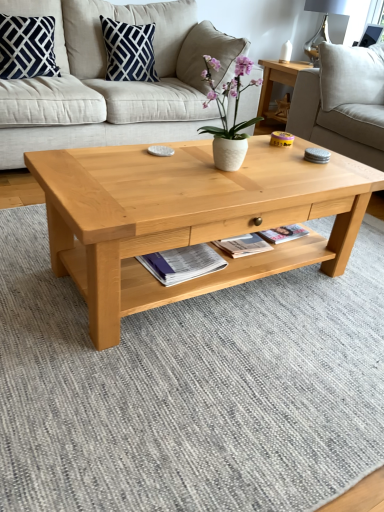
Question: Is navy blue cotton pillow at upper left, which is the 1th pillow in left-to-right order, bigger than white ceramic vase at center?

Choices:
 (A) no
 (B) yes

Answer: (B)

Question: Is navy blue cotton pillow at upper left, which is the 1th pillow in left-to-right order, next to white ceramic vase at center and touching it?

Choices:
 (A) yes
 (B) no

Answer: (B)

Question: From a real-world perspective, is navy blue cotton pillow at upper left, which is the 1th pillow in left-to-right order, physically below white ceramic vase at center?

Choices:
 (A) no
 (B) yes

Answer: (A)

Question: Does navy blue cotton pillow at upper left, which is the 1th pillow in left-to-right order, have a greater height compared to white ceramic vase at center?

Choices:
 (A) yes
 (B) no

Answer: (A)

Question: Is navy blue cotton pillow at upper left, the second pillow when ordered from right to left, wider than white ceramic vase at center?

Choices:
 (A) no
 (B) yes

Answer: (B)

Question: Does navy blue cotton pillow at upper left, which is the 1th pillow in left-to-right order, have a smaller size compared to white ceramic vase at center?

Choices:
 (A) no
 (B) yes

Answer: (A)

Question: Is light beige fabric studio couch at upper right, positioned as the 2th studio couch in left-to-right order, shorter than navy blue cotton pillow at upper left, the second pillow when ordered from right to left?

Choices:
 (A) yes
 (B) no

Answer: (B)

Question: Is light beige fabric studio couch at upper right, the first studio couch when ordered from right to left, at the right side of navy blue cotton pillow at upper left, the second pillow when ordered from right to left?

Choices:
 (A) no
 (B) yes

Answer: (B)

Question: Considering the relative positions of light beige fabric studio couch at upper right, positioned as the 2th studio couch in left-to-right order, and navy blue cotton pillow at upper left, the second pillow when ordered from right to left, in the image provided, is light beige fabric studio couch at upper right, positioned as the 2th studio couch in left-to-right order, to the left of navy blue cotton pillow at upper left, the second pillow when ordered from right to left, from the viewer's perspective?

Choices:
 (A) no
 (B) yes

Answer: (A)

Question: Does light beige fabric studio couch at upper right, the first studio couch when ordered from right to left, have a greater width compared to navy blue cotton pillow at upper left, which is the 1th pillow in left-to-right order?

Choices:
 (A) yes
 (B) no

Answer: (A)

Question: From a real-world perspective, is light beige fabric studio couch at upper right, positioned as the 2th studio couch in left-to-right order, over navy blue cotton pillow at upper left, which is the 1th pillow in left-to-right order?

Choices:
 (A) no
 (B) yes

Answer: (A)

Question: From the image's perspective, does light beige fabric studio couch at upper right, the first studio couch when ordered from right to left, appear lower than navy blue cotton pillow at upper left, which is the 1th pillow in left-to-right order?

Choices:
 (A) yes
 (B) no

Answer: (A)

Question: Is the position of navy blue cotton pillow at upper center, which is the second pillow in left-to-right order, more distant than that of navy blue cotton pillow at upper left, which is the 1th pillow in left-to-right order?

Choices:
 (A) no
 (B) yes

Answer: (B)